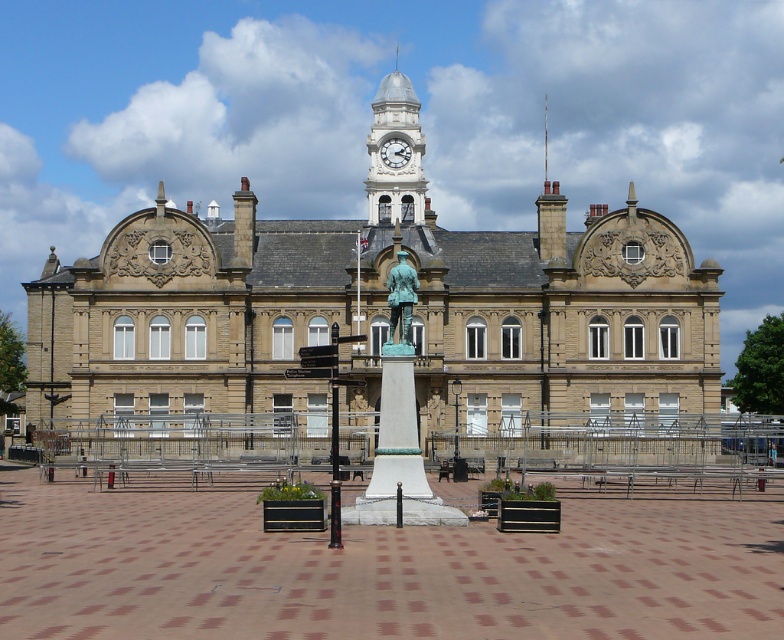
Consider the image. Does brick paving at center appear on the left side of bronze statue at center?

Indeed, brick paving at center is positioned on the left side of bronze statue at center.

Which is above, brick paving at center or bronze statue at center?

Positioned higher is bronze statue at center.

Between point (494, 627) and point (401, 324), which one is positioned behind?

Point (401, 324)

Find the location of a particular element. The image size is (784, 640). brick paving at center is located at coordinates (379, 570).

Does beige stone building at center appear under white stone clock tower at upper center?

Correct, beige stone building at center is located below white stone clock tower at upper center.

Is point (530, 410) closer to camera compared to point (416, 138)?

Yes, it is.

In order to click on beige stone building at center in this screenshot , I will do `click(376, 317)`.

Between point (300, 280) and point (401, 284), which one is positioned in front?

Point (401, 284) is in front.

Does beige stone building at center appear on the right side of bronze statue at center?

In fact, beige stone building at center is to the left of bronze statue at center.

The image size is (784, 640). I want to click on beige stone building at center, so click(376, 317).